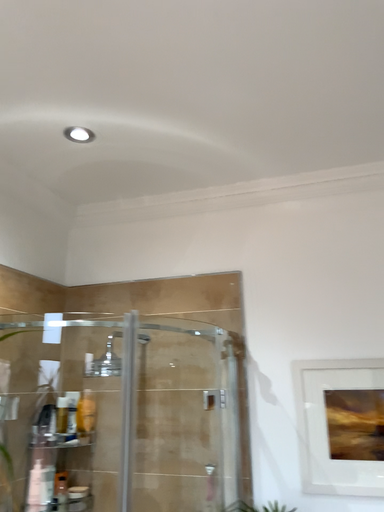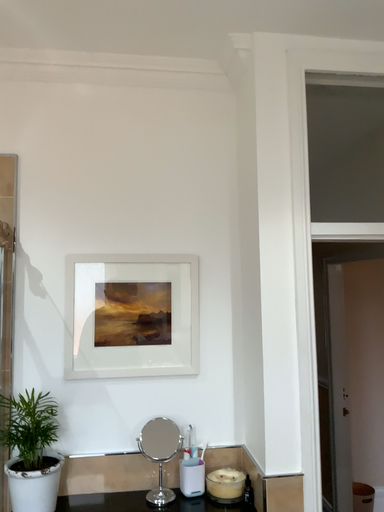
Question: How did the camera likely rotate when shooting the video?

Choices:
 (A) rotated right
 (B) rotated left

Answer: (A)